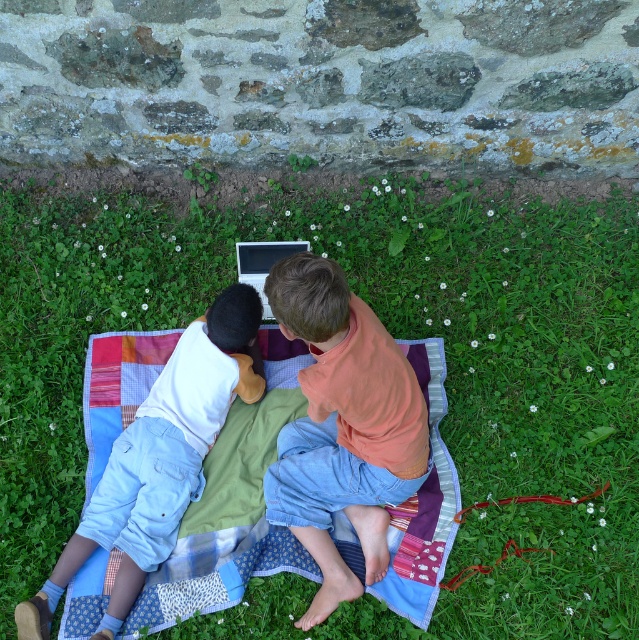
Can you confirm if orange cotton shirt at center is positioned below silver metallic laptop at center?

Correct, orange cotton shirt at center is located below silver metallic laptop at center.

The image size is (639, 640). In order to click on orange cotton shirt at center in this screenshot , I will do `click(343, 426)`.

Find the location of a particular element. This screenshot has height=640, width=639. orange cotton shirt at center is located at coordinates (343, 426).

Can you confirm if patchwork fabric quilt at center is smaller than orange cotton shirt at center?

No.

Does patchwork fabric quilt at center have a greater height compared to orange cotton shirt at center?

No.

Is point (210, 547) positioned before point (339, 384)?

No, it is behind (339, 384).

Locate an element on the screen. patchwork fabric quilt at center is located at coordinates (231, 508).

Which is more to the right, orange cotton shirt at center or light blue denim pants at lower left?

Positioned to the right is orange cotton shirt at center.

The width and height of the screenshot is (639, 640). What do you see at coordinates (343, 426) in the screenshot? I see `orange cotton shirt at center` at bounding box center [343, 426].

Who is more distant from viewer, (346, 284) or (174, 365)?

Point (174, 365)

Where is `orange cotton shirt at center`? orange cotton shirt at center is located at coordinates tap(343, 426).